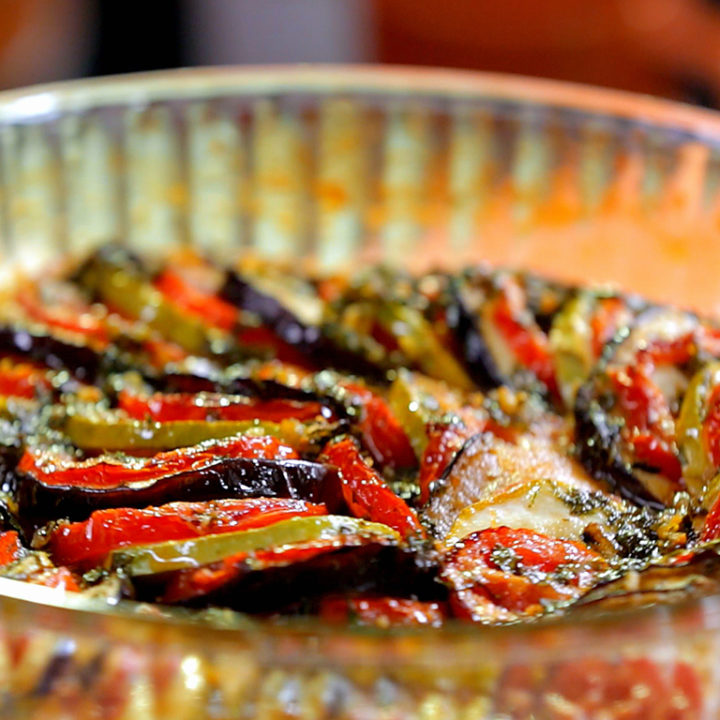
I want to click on plate, so click(397, 179).